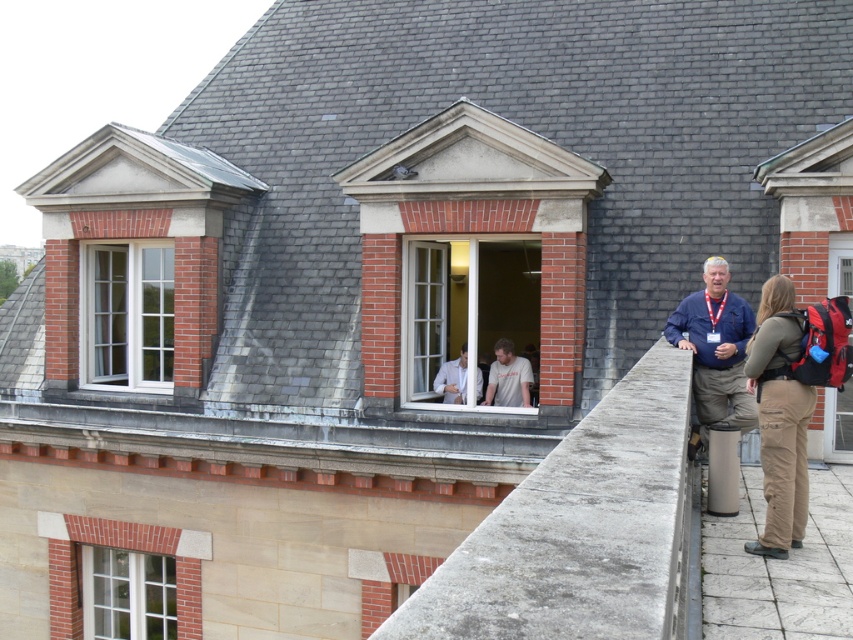
Describe the element at coordinates (779, 417) in the screenshot. This screenshot has height=640, width=853. I see `khaki cotton pants at right` at that location.

Is point (782, 301) less distant than point (107, 358)?

Yes, point (782, 301) is in front of point (107, 358).

Locate an element on the screen. khaki cotton pants at right is located at coordinates (779, 417).

Locate an element on the screen. The width and height of the screenshot is (853, 640). khaki cotton pants at right is located at coordinates (779, 417).

Can you confirm if clear glass window at center is positioned above light gray fabric shirt at center?

Indeed, clear glass window at center is positioned over light gray fabric shirt at center.

Can you confirm if clear glass window at center is shorter than light gray fabric shirt at center?

Yes, clear glass window at center is shorter than light gray fabric shirt at center.

Who is more distant from viewer, (419, 340) or (450, 381)?

The point (419, 340) is more distant.

Find the location of a particular element. clear glass window at center is located at coordinates (473, 321).

In the scene shown: Can you confirm if clear glass window at center is positioned below matte black window at center?

Incorrect, clear glass window at center is not positioned below matte black window at center.

Is clear glass window at center smaller than matte black window at center?

Yes.

Which is behind, point (525, 384) or point (827, 289)?

Point (525, 384)

You are a GUI agent. You are given a task and a screenshot of the screen. Output one action in this format:
    pyautogui.click(x=<x>, y=<y>)
    Task: Click on the clear glass window at center
    
    Given the screenshot: What is the action you would take?
    pyautogui.click(x=473, y=321)